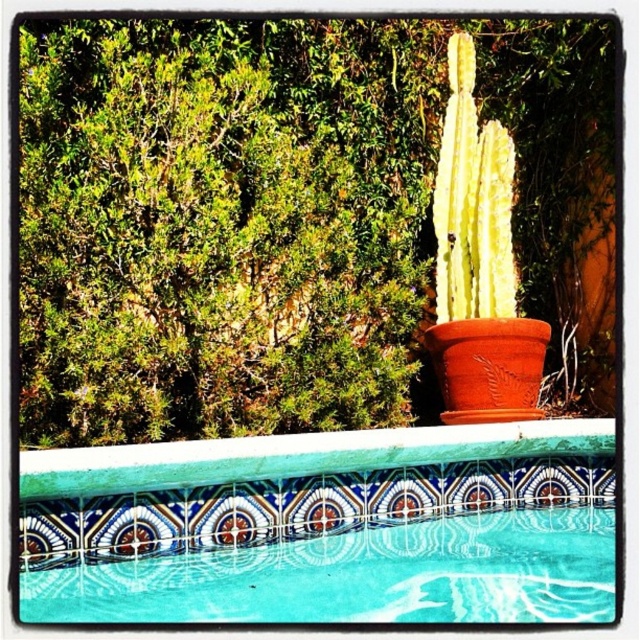
Question: Can you confirm if yellow-green spiky cactus at center-right is bigger than blue mosaic tile at upper center?

Choices:
 (A) yes
 (B) no

Answer: (A)

Question: Which object appears farthest from the camera in this image?

Choices:
 (A) yellow-green spiky cactus at center-right
 (B) blue mosaic tile at upper center

Answer: (A)

Question: Does yellow-green spiky cactus at center-right appear on the left side of blue mosaic tile at upper center?

Choices:
 (A) yes
 (B) no

Answer: (A)

Question: Is yellow-green spiky cactus at center-right wider than blue mosaic tile at upper center?

Choices:
 (A) yes
 (B) no

Answer: (A)